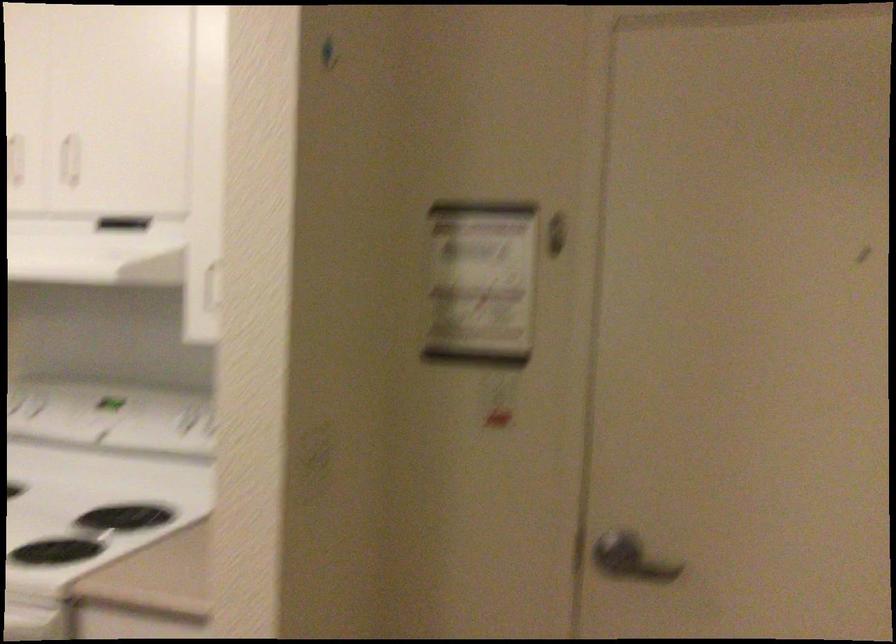
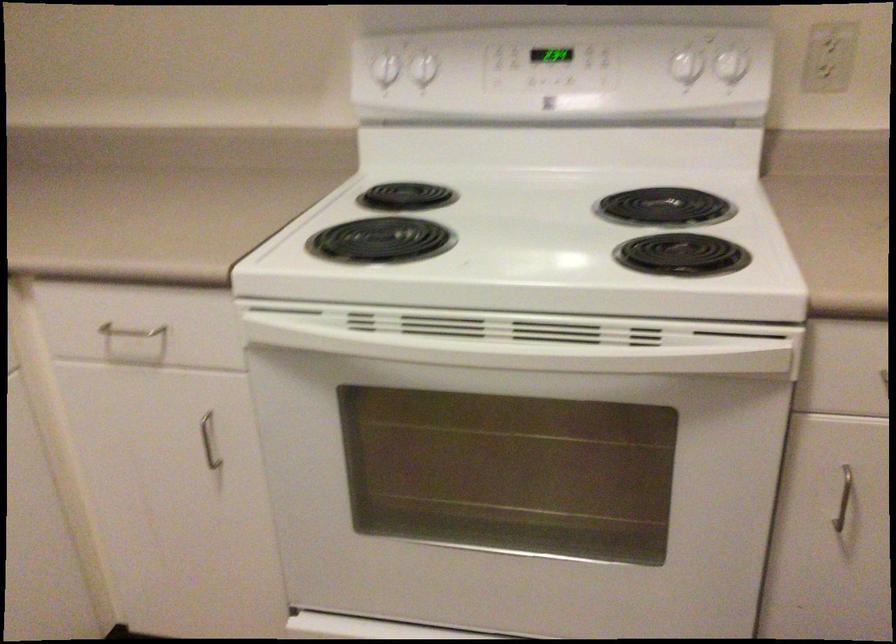
Where in the second image is the point corresponding to [124,518] from the first image?

(664, 207)